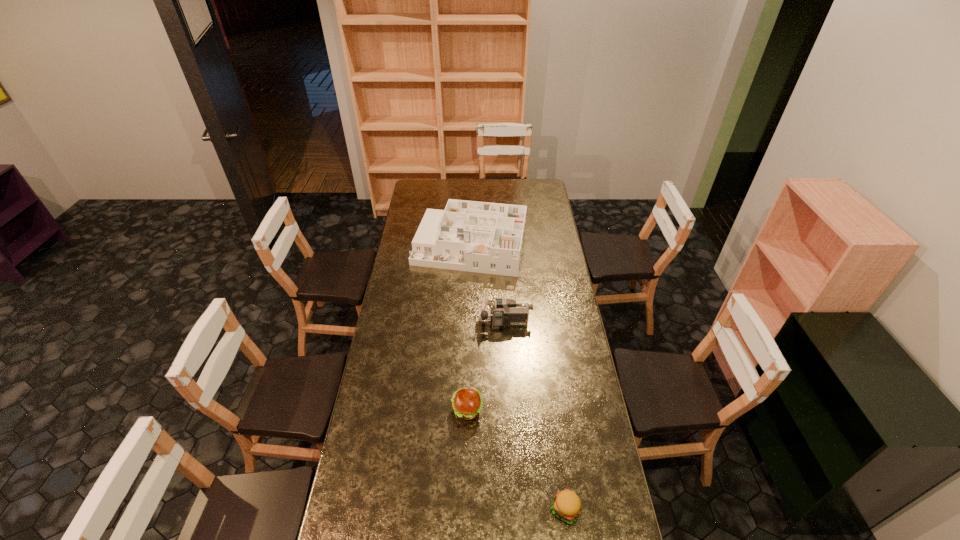
Where is `dollhouse`? dollhouse is located at coordinates (483, 237).

Image resolution: width=960 pixels, height=540 pixels. I want to click on the third nearest object, so click(x=505, y=312).

Where is `the left hamburger`? This screenshot has height=540, width=960. the left hamburger is located at coordinates (467, 403).

Where is `the farther hamburger`? the farther hamburger is located at coordinates coord(467,403).

Locate an element on the screen. The width and height of the screenshot is (960, 540). the shorter hamburger is located at coordinates (566, 505).

Locate an element on the screen. the nearer hamburger is located at coordinates (566, 505).

Find the location of a particular element. The image size is (960, 540). vacant space located 0.080m on the front of the farthest object is located at coordinates (468, 288).

This screenshot has height=540, width=960. I want to click on free space located on the front-facing side of the camcorder, so 420,322.

Where is `blank space located 0.250m on the front-facing side of the camcorder`? This screenshot has height=540, width=960. blank space located 0.250m on the front-facing side of the camcorder is located at coordinates (424, 322).

You are a GUI agent. You are given a task and a screenshot of the screen. Output one action in this format:
    pyautogui.click(x=<x>, y=<y>)
    Task: Click on the free space located 0.230m on the front-facing side of the camcorder
    
    Given the screenshot: What is the action you would take?
    pyautogui.click(x=429, y=322)